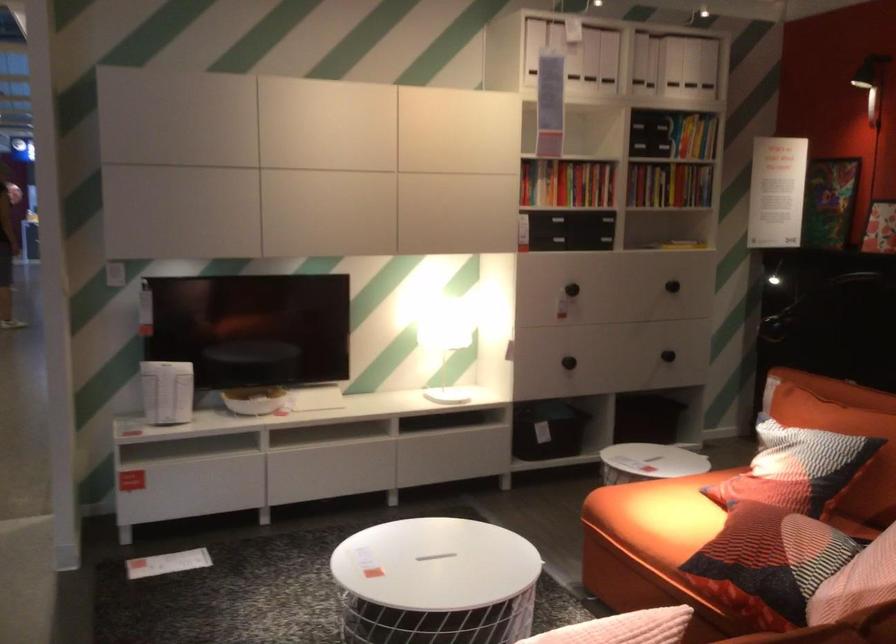
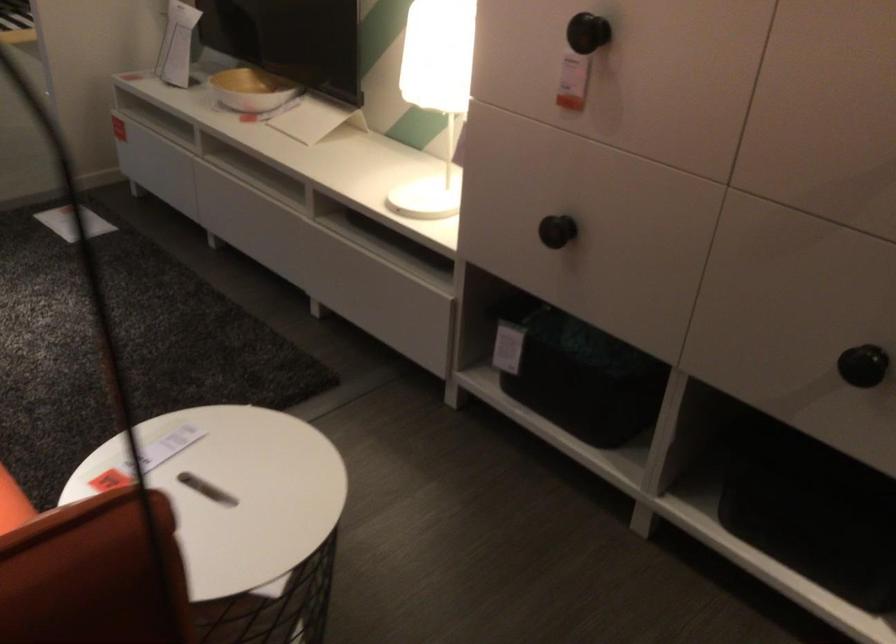
The point at (604, 344) is marked in the first image. Where is the corresponding point in the second image?

(556, 231)